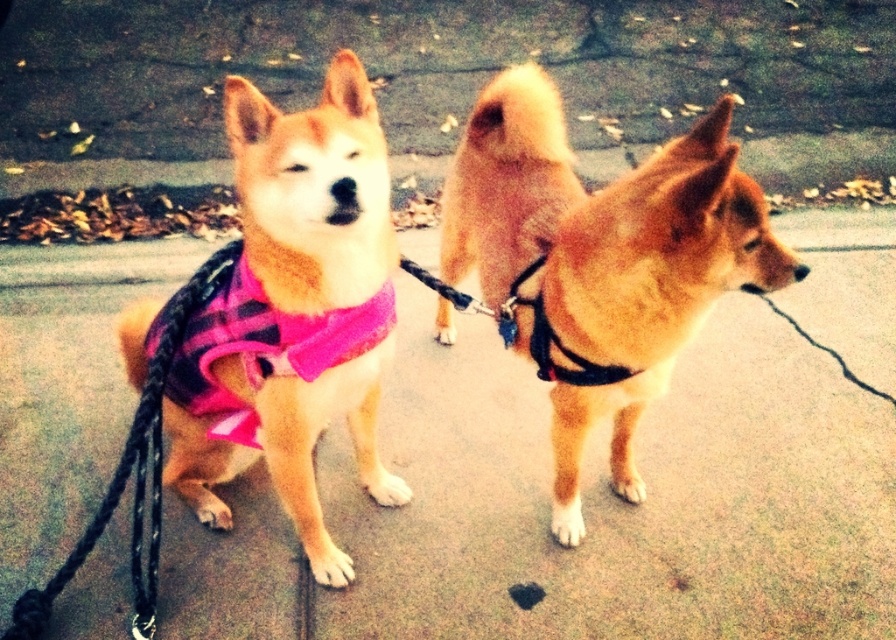
Question: Is matte pink fabric at center bigger than pink fabric neckband at center?

Choices:
 (A) yes
 (B) no

Answer: (A)

Question: Is smooth concrete pavement at center wider than matte pink fabric at center?

Choices:
 (A) no
 (B) yes

Answer: (B)

Question: Which object appears closest to the camera in this image?

Choices:
 (A) smooth concrete pavement at center
 (B) pink fabric neckband at center

Answer: (B)

Question: Among these points, which one is farthest from the camera?

Choices:
 (A) (705, 620)
 (B) (329, 355)
 (C) (444, 227)

Answer: (C)

Question: Estimate the real-world distances between objects in this image. Which object is farther from the golden fur dog at center?

Choices:
 (A) matte pink fabric at center
 (B) smooth concrete pavement at center

Answer: (B)

Question: Is smooth concrete pavement at center further to the viewer compared to pink fabric neckband at center?

Choices:
 (A) yes
 (B) no

Answer: (A)